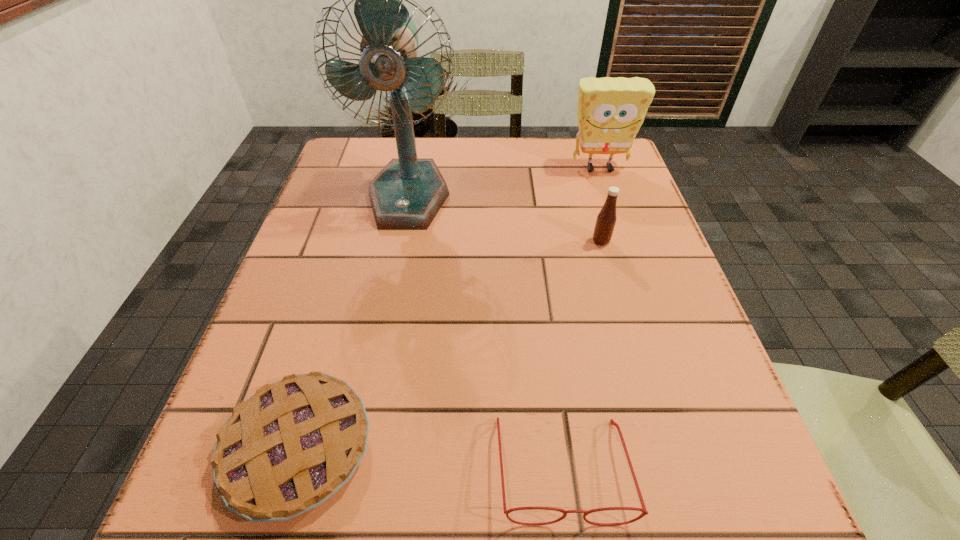
Locate an element on the screen. The height and width of the screenshot is (540, 960). blank area located 0.160m on the back of the shortest object is located at coordinates (340, 306).

I want to click on fan positioned at the far edge, so click(407, 194).

Locate an element on the screen. Image resolution: width=960 pixels, height=540 pixels. sponge that is at the far edge is located at coordinates (610, 112).

I want to click on spectacles located in the near edge section of the desktop, so click(x=644, y=512).

You are a GUI agent. You are given a task and a screenshot of the screen. Output one action in this format:
    pyautogui.click(x=<x>, y=<y>)
    Task: Click on the pie that is at the near edge
    
    Given the screenshot: What is the action you would take?
    (x=285, y=450)

The image size is (960, 540). In order to click on fan present at the left edge in this screenshot , I will do `click(407, 194)`.

Find the location of a particular element. pie at the left edge is located at coordinates (285, 450).

Locate an element on the screen. sponge that is at the right edge is located at coordinates (610, 112).

I want to click on Tabasco sauce located in the right edge section of the desktop, so click(x=606, y=219).

Locate an element on the screen. object that is at the far left corner is located at coordinates 407,194.